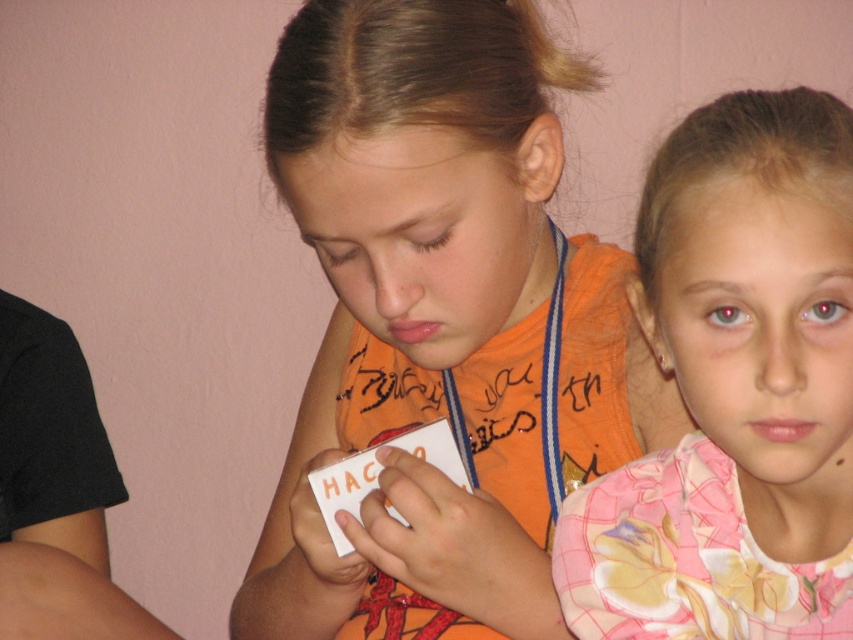
You are a photographer trying to capture a group photo of the orange fabric shirt at center and the pink floral shirt at upper right. Which of the two shirts should you place on the left side to match the original image?

The orange fabric shirt at center should be placed on the left side because it is positioned on the left side of the pink floral shirt at upper right in the original image.

You are a photographer trying to capture a clear shot of both the orange fabric shirt at center and the white paper card at center. Since you can only focus on one object at a time, which object should you focus on first to ensure the other is still in the frame?

The orange fabric shirt at center is to the right of the white paper card at center, so focusing on the white paper card at center first would keep the orange fabric shirt at center within the frame as it is positioned to the right side.